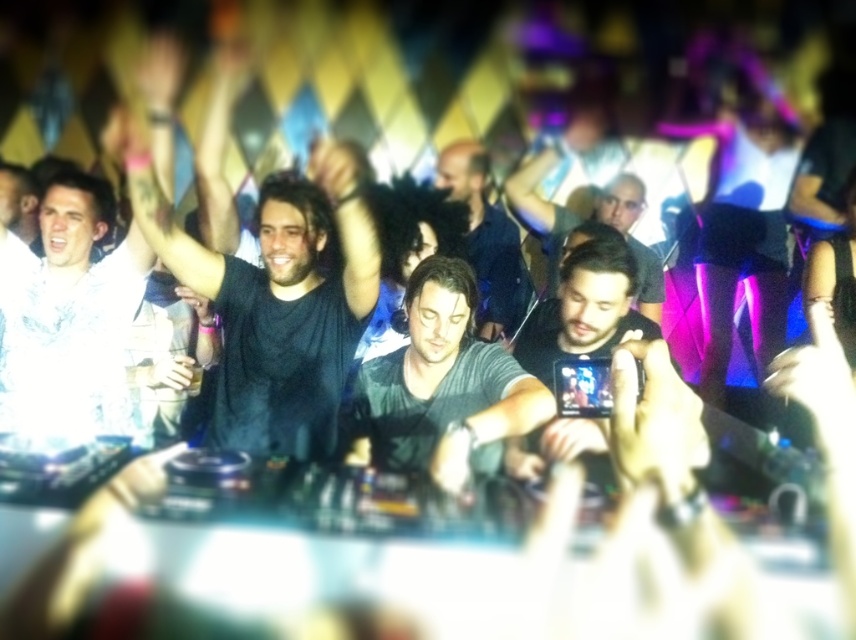
Question: Is black matte shirt at center bigger than black matte phone at center?

Choices:
 (A) no
 (B) yes

Answer: (B)

Question: Does white cotton shirt at upper left appear over gray cotton shirt at center?

Choices:
 (A) no
 (B) yes

Answer: (B)

Question: Considering the relative positions of black matte shirt at center and gray cotton shirt at center in the image provided, where is black matte shirt at center located with respect to gray cotton shirt at center?

Choices:
 (A) below
 (B) above

Answer: (B)

Question: Which of these objects is positioned closest to the gray cotton shirt at center?

Choices:
 (A) black matte shirt at center
 (B) dark blue shirt at center
 (C) white cotton shirt at upper left
 (D) dark gray shirt at center

Answer: (B)

Question: Which object is the closest to the white cotton shirt at upper left?

Choices:
 (A) dark blue shirt at center
 (B) black matte phone at center

Answer: (A)

Question: Based on their relative distances, which object is nearer to the white cotton shirt at upper left?

Choices:
 (A) gray cotton shirt at center
 (B) black matte phone at center
 (C) dark gray shirt at center

Answer: (A)